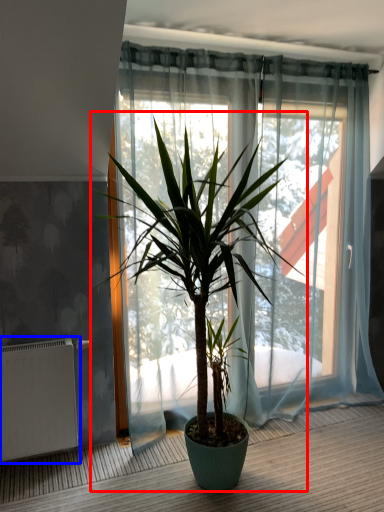
Question: Which point is closer to the camera, houseplant (highlighted by a red box) or radiator (highlighted by a blue box)?

Choices:
 (A) houseplant
 (B) radiator

Answer: (A)